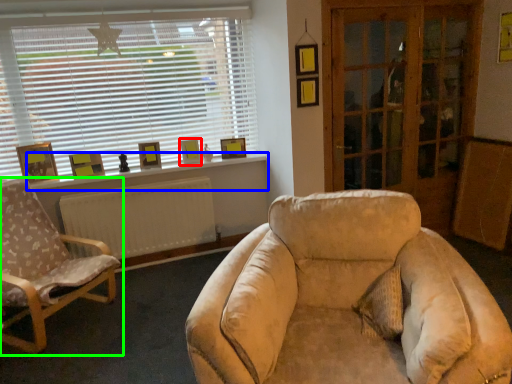
Question: Which object is the closest to the picture frame (highlighted by a red box)? Choose among these: window sill (highlighted by a blue box) or chair (highlighted by a green box).

Choices:
 (A) window sill
 (B) chair

Answer: (A)